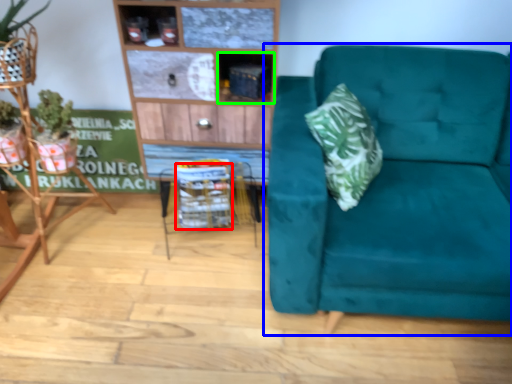
Question: Which object is the closest to the basket (highlighted by a red box)? Choose among these: studio couch (highlighted by a blue box) or cabinet (highlighted by a green box).

Choices:
 (A) studio couch
 (B) cabinet

Answer: (B)